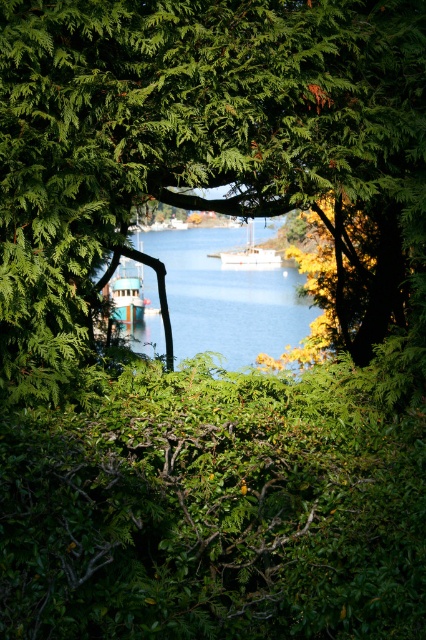
Does teal glossy boat at center appear on the right side of white matte sailboat at center?

Incorrect, teal glossy boat at center is not on the right side of white matte sailboat at center.

Who is taller, teal glossy boat at center or white matte sailboat at center?

teal glossy boat at center

The image size is (426, 640). What do you see at coordinates (126, 292) in the screenshot? I see `teal glossy boat at center` at bounding box center [126, 292].

Identify the location of teal glossy boat at center. (126, 292).

Can you confirm if green leafy tree at center is positioned below blue water at center?

Incorrect, green leafy tree at center is not positioned below blue water at center.

Between green leafy tree at center and blue water at center, which one is positioned lower?

blue water at center is lower down.

Who is more forward, (68, 35) or (215, 307)?

Point (68, 35) is more forward.

Where is `green leafy tree at center`? green leafy tree at center is located at coordinates (204, 148).

Based on the photo, is blue water at center to the left of white matte sailboat at center from the viewer's perspective?

Correct, you'll find blue water at center to the left of white matte sailboat at center.

Does blue water at center have a greater width compared to white matte sailboat at center?

Indeed, blue water at center has a greater width compared to white matte sailboat at center.

Locate an element on the screen. This screenshot has height=640, width=426. blue water at center is located at coordinates (227, 296).